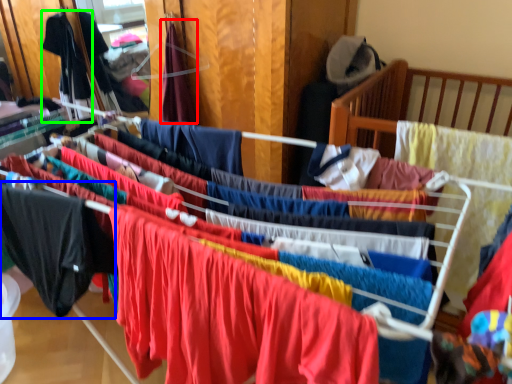
Question: Based on their relative distances, which object is nearer to clothing (highlighted by a red box)? Choose from clothing (highlighted by a blue box) and clothing (highlighted by a green box).

Choices:
 (A) clothing
 (B) clothing

Answer: (B)